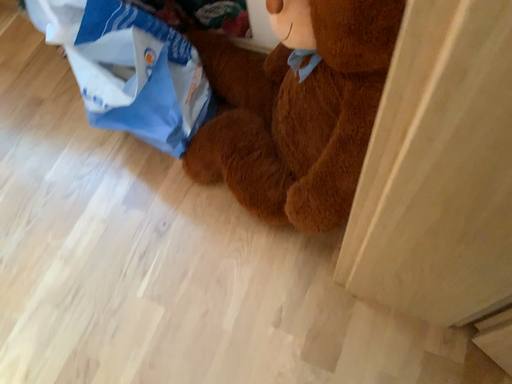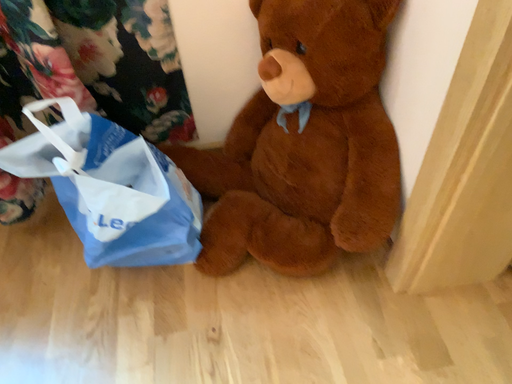
Question: How did the camera likely rotate when shooting the video?

Choices:
 (A) rotated upward
 (B) rotated downward

Answer: (A)